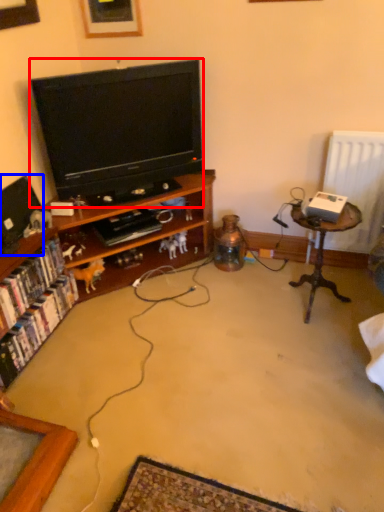
Question: Which object appears closest to the camera in this image, television (highlighted by a red box) or television (highlighted by a blue box)?

Choices:
 (A) television
 (B) television

Answer: (B)